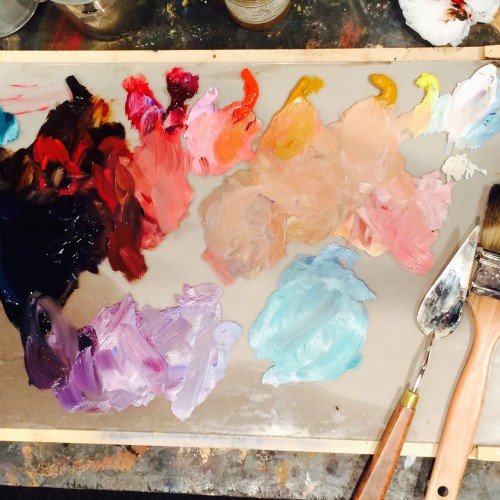
Where is `purple paint`? The height and width of the screenshot is (500, 500). purple paint is located at coordinates (81, 383).